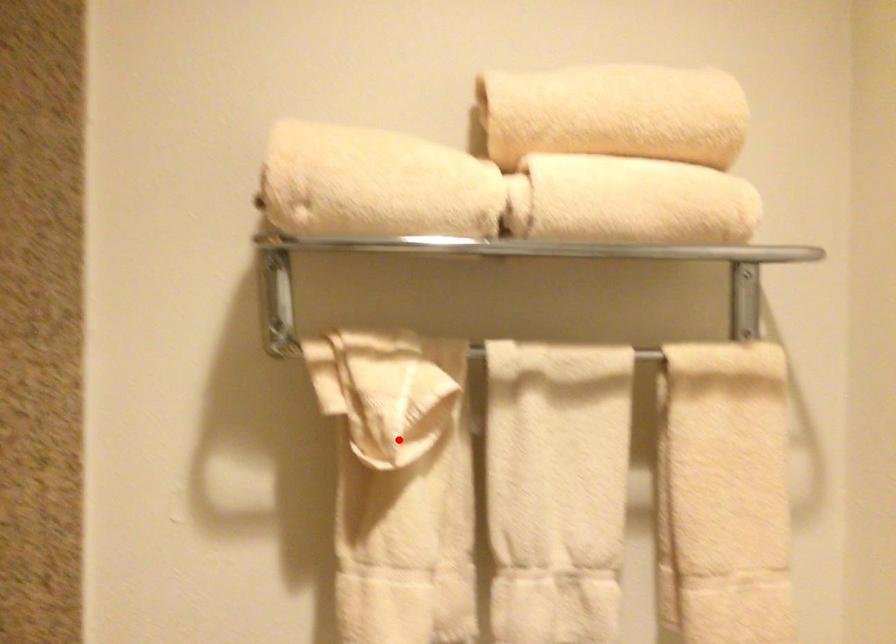
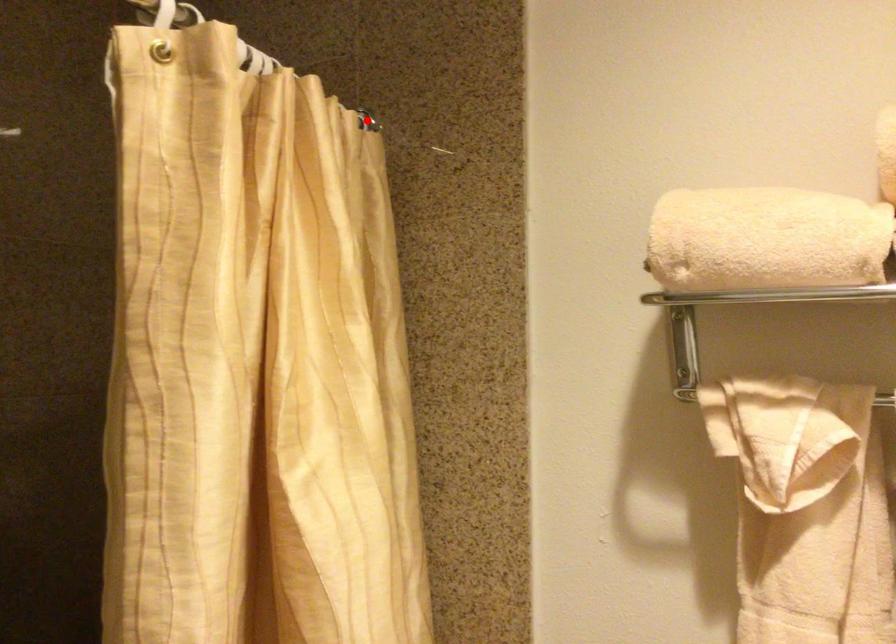
I am providing you with two images of the same scene from different viewpoints. A red point is marked on the first image and another point is marked on the second image. Is the marked point in image1 the same physical position as the marked point in image2?

No